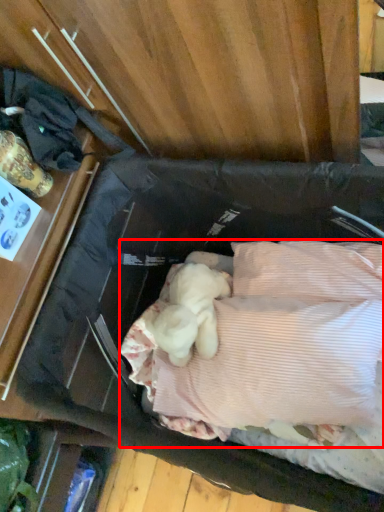
Question: From the image's perspective, where is wide (annotated by the red box) located in relation to clothing in the image?

Choices:
 (A) above
 (B) below

Answer: (B)